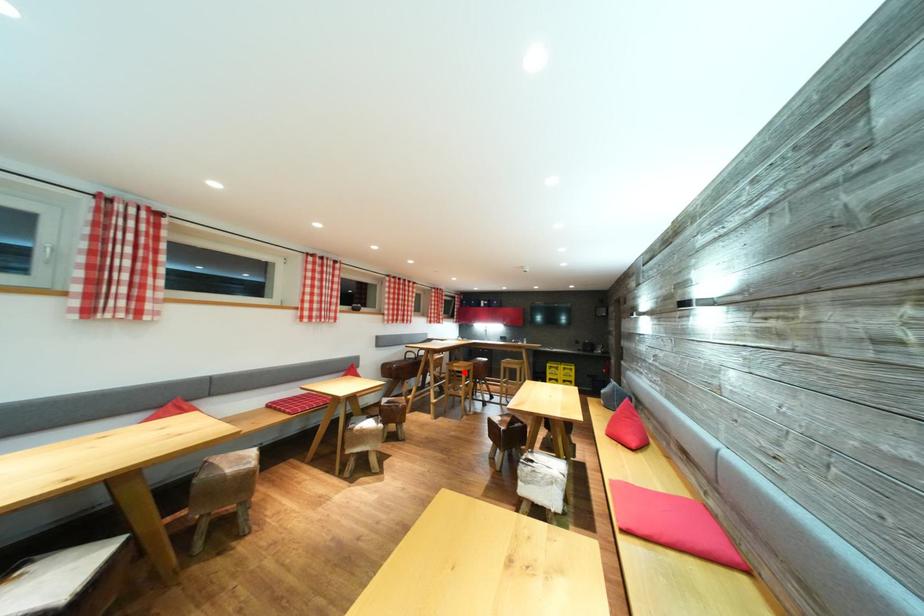
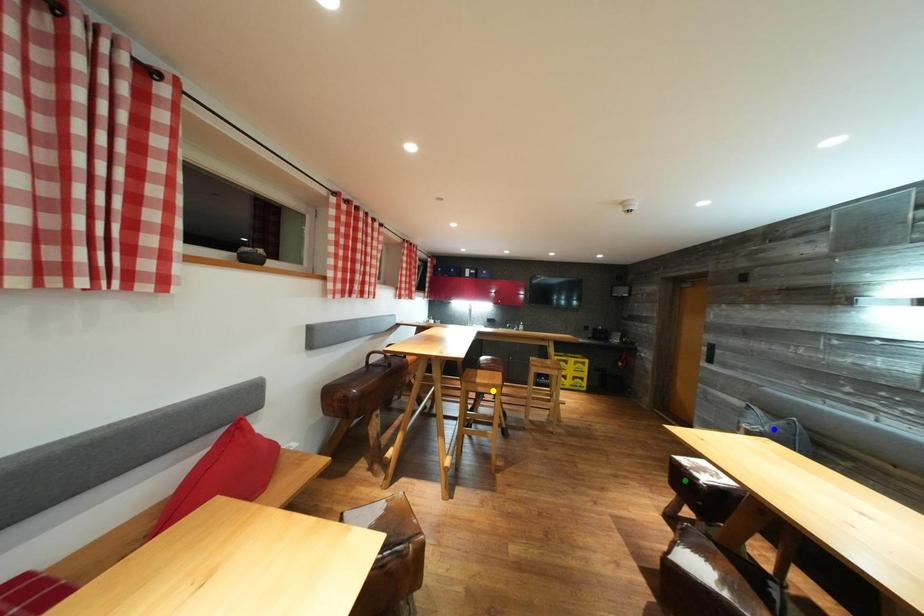
Question: I am providing you with two images of the same scene from different viewpoints. A red point is marked on the first image. You are given multiple points on the second image. Which mark in image 2 goes with the point in image 1?

Choices:
 (A) yellow point
 (B) green point
 (C) blue point

Answer: (A)